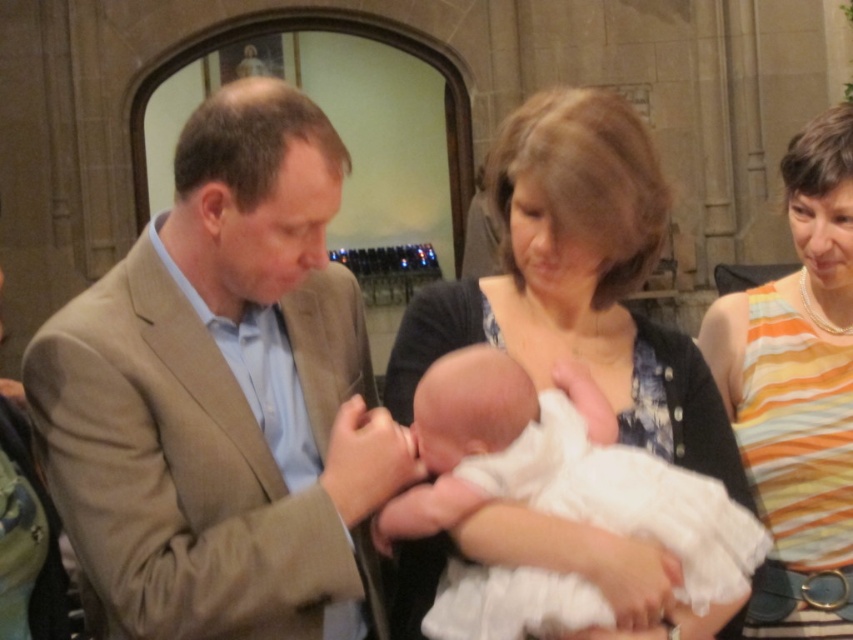
From the picture: Between orange striped tank top at right and white clothed newborn at center, which one appears on the right side from the viewer's perspective?

orange striped tank top at right

Who is positioned more to the left, orange striped tank top at right or white clothed newborn at center?

Positioned to the left is white clothed newborn at center.

Identify the location of orange striped tank top at right. This screenshot has width=853, height=640. (798, 392).

Does light brown suit at center have a lesser height compared to orange striped tank top at right?

No, light brown suit at center is not shorter than orange striped tank top at right.

At what (x,y) coordinates should I click in order to perform the action: click on light brown suit at center. Please return your answer as a coordinate pair (x, y). This screenshot has height=640, width=853. Looking at the image, I should click on (224, 396).

Is point (242, 592) behind point (849, 576)?

No, it is not.

Identify the location of light brown suit at center. The width and height of the screenshot is (853, 640). (224, 396).

Is light brown suit at center to the left of white clothed newborn at center from the viewer's perspective?

Yes, light brown suit at center is to the left of white clothed newborn at center.

Can you confirm if light brown suit at center is positioned above white clothed newborn at center?

Actually, light brown suit at center is below white clothed newborn at center.

Is point (231, 177) closer to camera compared to point (553, 508)?

That is False.

Locate an element on the screen. This screenshot has width=853, height=640. light brown suit at center is located at coordinates (224, 396).